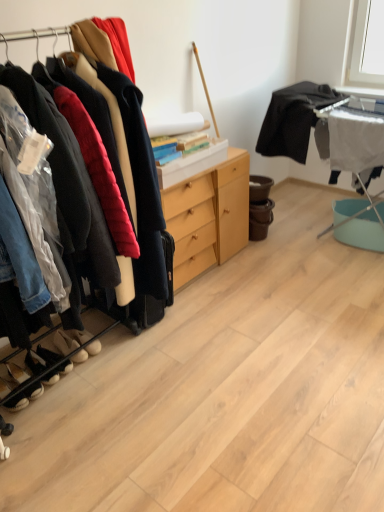
Question: In the image, is suede beige shoes at lower left, the 2th footwear viewed from the back, on the left side or the right side of white suede shoes at lower left, the 1th footwear viewed from the front?

Choices:
 (A) left
 (B) right

Answer: (B)

Question: Considering the positions of point (72, 344) and point (4, 373), is point (72, 344) closer or farther from the camera than point (4, 373)?

Choices:
 (A) closer
 (B) farther

Answer: (B)

Question: Estimate the real-world distances between objects in this image. Which object is closer to the black suede shoes at lower left, which appears as the second footwear when viewed from the front?

Choices:
 (A) white suede shoes at lower left, the 1th footwear viewed from the front
 (B) white suede shoes at lower left, which ranks as the 5th footwear in front-to-back order
 (C) suede beige shoes at lower left, placed as the 4th footwear when sorted from front to back
 (D) black matte shirt at upper right
 (E) light wood/finely finished cabinet at center

Answer: (A)

Question: Which of these objects is positioned closest to the black matte shirt at upper right?

Choices:
 (A) black suede shoes at lower left, which appears as the second footwear when viewed from the front
 (B) black suede shoes at lower left, acting as the third footwear starting from the front
 (C) suede beige shoes at lower left, the 2th footwear viewed from the back
 (D) light wood/finely finished cabinet at center
 (E) white fabric ironing board at right

Answer: (E)